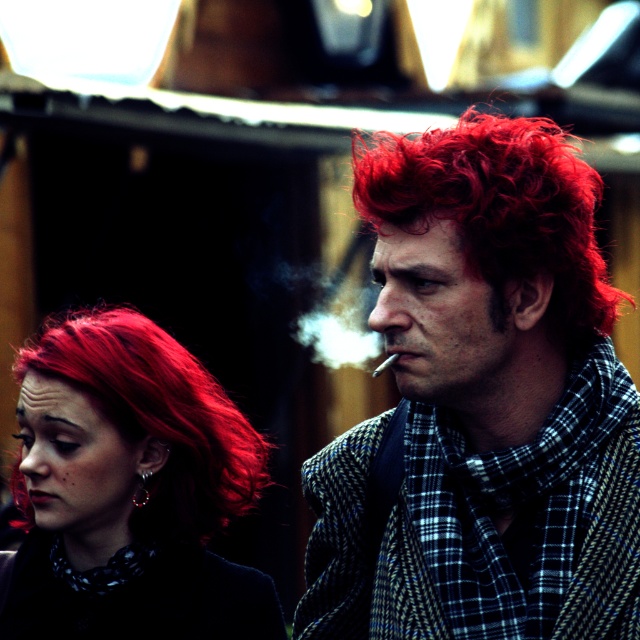
Question: From the image, what is the correct spatial relationship of shiny red hair at center in relation to white smoke at center?

Choices:
 (A) above
 (B) below

Answer: (B)

Question: Is matte red wig at center to the right of shiny red hair at center from the viewer's perspective?

Choices:
 (A) yes
 (B) no

Answer: (A)

Question: Which object is positioned closest to the shiny red hair at center?

Choices:
 (A) matte red wig at center
 (B) white smoke at center
 (C) matte silver cigarette at center

Answer: (C)

Question: Estimate the real-world distances between objects in this image. Which object is farther from the shiny red hair at center?

Choices:
 (A) matte silver cigarette at center
 (B) matte red wig at center
 (C) curly matte red hair at center

Answer: (B)

Question: Is matte red wig at center below white smoke at center?

Choices:
 (A) no
 (B) yes

Answer: (B)

Question: Which of the following is the closest to the observer?

Choices:
 (A) matte red wig at center
 (B) matte silver cigarette at center

Answer: (A)